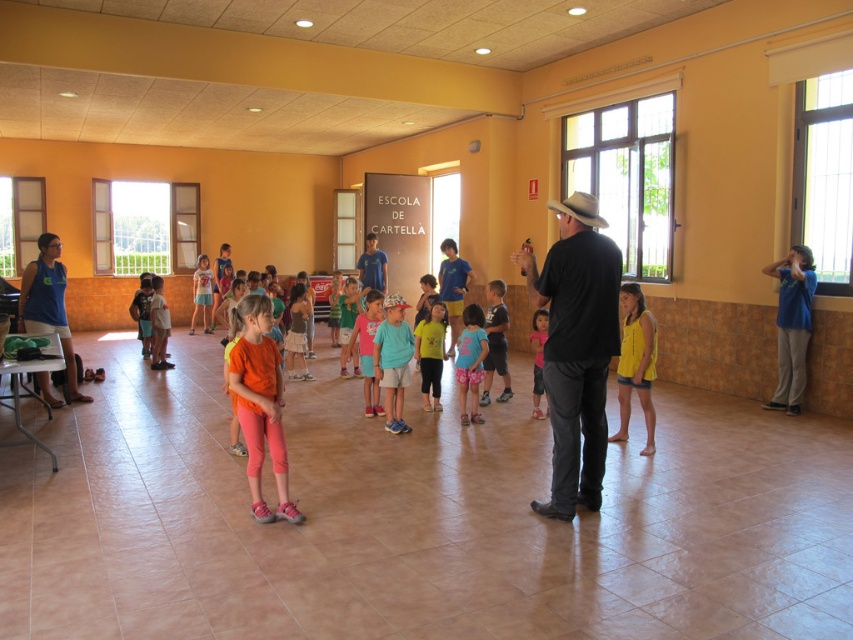
Which is below, orange matte t-shirt at center or brown felt cowboy hat at upper center?

orange matte t-shirt at center

Is orange matte t-shirt at center below brown felt cowboy hat at upper center?

Yes.

Which is in front, point (252, 296) or point (598, 216)?

Point (252, 296)

This screenshot has width=853, height=640. I want to click on orange matte t-shirt at center, so click(x=260, y=403).

Find the location of a particular element. This screenshot has width=853, height=640. orange matte t-shirt at center is located at coordinates (260, 403).

You are a GUI agent. You are given a task and a screenshot of the screen. Output one action in this format:
    pyautogui.click(x=<x>, y=<y>)
    Task: Click on the orange matte t-shirt at center
    Image resolution: width=853 pixels, height=640 pixels.
    Given the screenshot: What is the action you would take?
    pyautogui.click(x=260, y=403)

Where is `orange matte t-shirt at center`? Image resolution: width=853 pixels, height=640 pixels. orange matte t-shirt at center is located at coordinates (260, 403).

Who is taller, matte pink shirt at center or matte orange shirt at center?

With more height is matte orange shirt at center.

Who is shorter, matte pink shirt at center or matte orange shirt at center?

Standing shorter between the two is matte pink shirt at center.

Identify the location of matte pink shirt at center. pos(368,348).

Locate an element on the screen. The width and height of the screenshot is (853, 640). matte pink shirt at center is located at coordinates (368, 348).